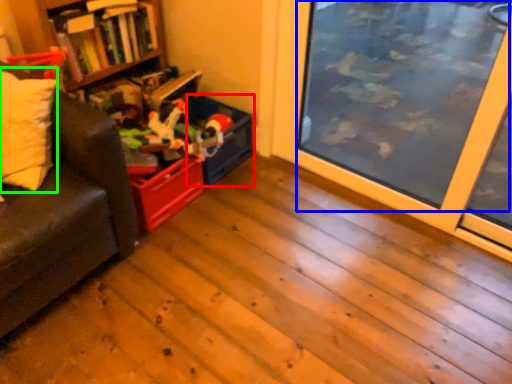
Question: Which object is the closest to the storage box (highlighted by a red box)? Choose among these: window screen (highlighted by a blue box) or pillow (highlighted by a green box).

Choices:
 (A) window screen
 (B) pillow

Answer: (B)